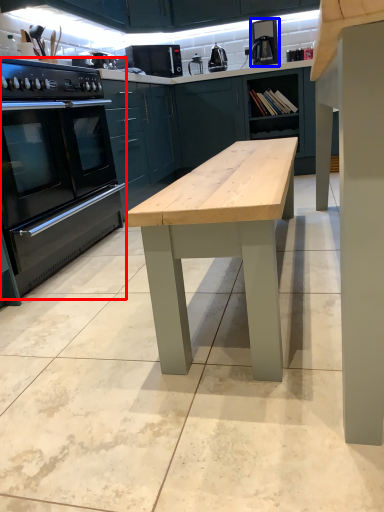
Question: Which point is further to the camera, home appliance (highlighted by a red box) or coffee machine (highlighted by a blue box)?

Choices:
 (A) home appliance
 (B) coffee machine

Answer: (B)